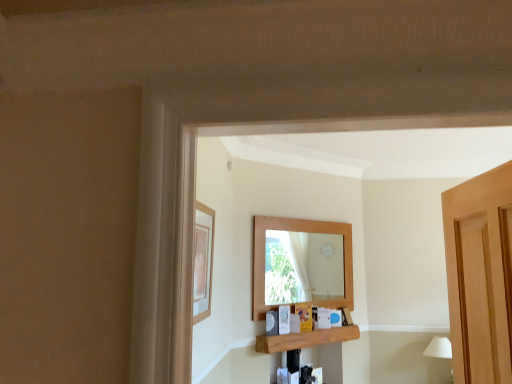
Question: From a real-world perspective, does matte wooden picture frame at upper left sit lower than wooden shelf at center?

Choices:
 (A) no
 (B) yes

Answer: (A)

Question: Is there a large distance between matte wooden picture frame at upper left and wooden shelf at center?

Choices:
 (A) no
 (B) yes

Answer: (B)

Question: From the image's perspective, would you say matte wooden picture frame at upper left is shown under wooden shelf at center?

Choices:
 (A) yes
 (B) no

Answer: (B)

Question: Can you confirm if matte wooden picture frame at upper left is taller than wooden shelf at center?

Choices:
 (A) no
 (B) yes

Answer: (B)

Question: Is matte wooden picture frame at upper left facing towards wooden shelf at center?

Choices:
 (A) no
 (B) yes

Answer: (A)

Question: Would you say wooden shelf at center is to the left or to the right of white matte lampshade at lower right in the picture?

Choices:
 (A) right
 (B) left

Answer: (B)

Question: Is point (345, 339) closer or farther from the camera than point (425, 352)?

Choices:
 (A) closer
 (B) farther

Answer: (A)

Question: Looking at their shapes, would you say wooden shelf at center is wider or thinner than white matte lampshade at lower right?

Choices:
 (A) thin
 (B) wide

Answer: (A)

Question: Considering their positions, is wooden shelf at center located in front of or behind white matte lampshade at lower right?

Choices:
 (A) front
 (B) behind

Answer: (A)

Question: Is matte wooden picture frame at upper left wider or thinner than white matte lampshade at lower right?

Choices:
 (A) wide
 (B) thin

Answer: (B)

Question: From the image's perspective, is matte wooden picture frame at upper left positioned above or below white matte lampshade at lower right?

Choices:
 (A) above
 (B) below

Answer: (A)

Question: Is point (205, 299) closer or farther from the camera than point (432, 354)?

Choices:
 (A) farther
 (B) closer

Answer: (B)

Question: From a real-world perspective, relative to white matte lampshade at lower right, is matte wooden picture frame at upper left vertically above or below?

Choices:
 (A) above
 (B) below

Answer: (A)

Question: Looking at their shapes, would you say white matte lampshade at lower right is wider or thinner than wooden shelf at center?

Choices:
 (A) thin
 (B) wide

Answer: (B)

Question: From the image's perspective, is white matte lampshade at lower right above or below wooden shelf at center?

Choices:
 (A) above
 (B) below

Answer: (B)